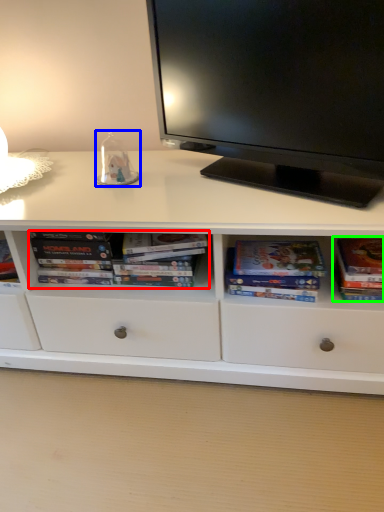
Question: Considering the real-world distances, which object is farthest from book (highlighted by a red box)? toy (highlighted by a blue box) or paperback book (highlighted by a green box)?

Choices:
 (A) toy
 (B) paperback book

Answer: (B)